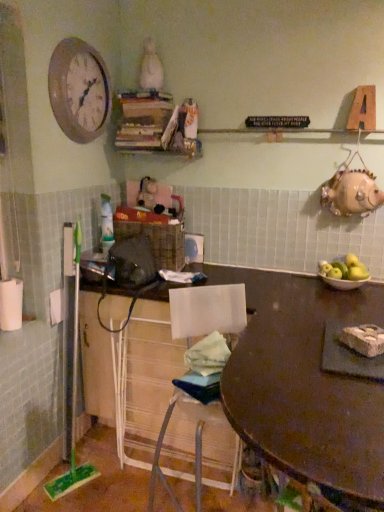
Question: Is matte white bowl at right completely or partially outside of green matte apples at right?

Choices:
 (A) yes
 (B) no

Answer: (A)

Question: Does matte white bowl at right have a lesser height compared to green matte apples at right?

Choices:
 (A) yes
 (B) no

Answer: (A)

Question: Considering the relative sizes of matte white bowl at right and green matte apples at right in the image provided, is matte white bowl at right wider than green matte apples at right?

Choices:
 (A) no
 (B) yes

Answer: (B)

Question: Would you say matte white bowl at right contains green matte apples at right?

Choices:
 (A) yes
 (B) no

Answer: (B)

Question: Is matte white bowl at right looking in the opposite direction of green matte apples at right?

Choices:
 (A) no
 (B) yes

Answer: (A)

Question: Is point tap(89, 92) positioned closer to the camera than point tap(334, 262)?

Choices:
 (A) farther
 (B) closer

Answer: (B)

Question: Do you think wooden clock at upper left is within green matte apples at right, or outside of it?

Choices:
 (A) outside
 (B) inside

Answer: (A)

Question: Looking at their shapes, would you say wooden clock at upper left is wider or thinner than green matte apples at right?

Choices:
 (A) wide
 (B) thin

Answer: (B)

Question: From a real-world perspective, is wooden clock at upper left above or below green matte apples at right?

Choices:
 (A) below
 (B) above

Answer: (B)

Question: Is point (140, 348) closer or farther from the camera than point (13, 307)?

Choices:
 (A) farther
 (B) closer

Answer: (A)

Question: From a real-world perspective, is white wire mesh cabinet at lower center physically located above or below white matte toilet paper at left?

Choices:
 (A) below
 (B) above

Answer: (A)

Question: In the image, is white wire mesh cabinet at lower center positioned in front of or behind white matte toilet paper at left?

Choices:
 (A) behind
 (B) front

Answer: (B)

Question: Is white wire mesh cabinet at lower center taller or shorter than white matte toilet paper at left?

Choices:
 (A) tall
 (B) short

Answer: (A)

Question: Is point (372, 342) positioned closer to the camera than point (94, 371)?

Choices:
 (A) closer
 (B) farther

Answer: (A)

Question: Considering the relative positions of white crumbly food at table and white wire mesh cabinet at lower center in the image provided, is white crumbly food at table to the left or to the right of white wire mesh cabinet at lower center?

Choices:
 (A) left
 (B) right

Answer: (B)